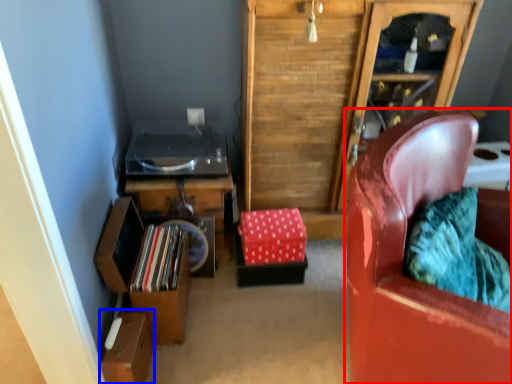
Question: Which object is closer to the camera taking this photo, chair (highlighted by a red box) or box (highlighted by a blue box)?

Choices:
 (A) chair
 (B) box

Answer: (A)